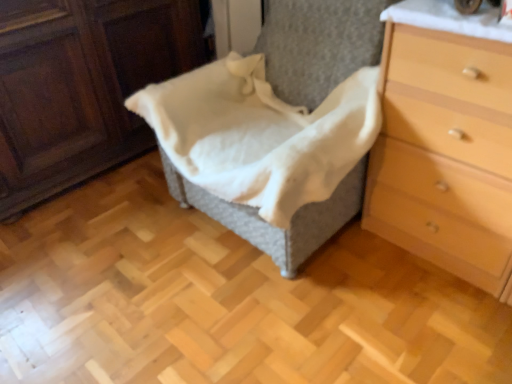
The image size is (512, 384). What are the coordinates of `light brown wood chest of drawers at right` in the screenshot? It's located at (445, 153).

Measure the distance between point (5, 214) and camera.

A distance of 6.17 feet exists between point (5, 214) and camera.

This screenshot has width=512, height=384. What are the coordinates of `white cotton blanket at center` in the screenshot? It's located at [260, 134].

Where is `light brown wood chest of drawers at right`? The image size is (512, 384). light brown wood chest of drawers at right is located at coordinates (445, 153).

From their relative heights in the image, would you say light brown wood chest of drawers at right is taller or shorter than woven fabric basket at center?

In the image, light brown wood chest of drawers at right appears to be shorter than woven fabric basket at center.

Is the surface of light brown wood chest of drawers at right in direct contact with woven fabric basket at center?

No, light brown wood chest of drawers at right is not in contact with woven fabric basket at center.

In the scene shown: Can you confirm if light brown wood chest of drawers at right is smaller than woven fabric basket at center?

Correct, light brown wood chest of drawers at right occupies less space than woven fabric basket at center.

Between light brown wood chest of drawers at right and woven fabric basket at center, which one has larger width?

woven fabric basket at center.

Which of these two, white cotton blanket at center or light brown wood chest of drawers at right, stands taller?

light brown wood chest of drawers at right.

Is white cotton blanket at center looking in the opposite direction of light brown wood chest of drawers at right?

That's not correct — white cotton blanket at center is not looking away from light brown wood chest of drawers at right.

Can you tell me how much white cotton blanket at center and light brown wood chest of drawers at right differ in facing direction?

0.538 degrees separate the facing orientations of white cotton blanket at center and light brown wood chest of drawers at right.

From the image's perspective, which is above, white cotton blanket at center or light brown wood chest of drawers at right?

white cotton blanket at center is shown above in the image.

Which is more to the left, white cotton blanket at center or woven fabric basket at center?

From the viewer's perspective, woven fabric basket at center appears more on the left side.

From a real-world perspective, which is physically above, white cotton blanket at center or woven fabric basket at center?

white cotton blanket at center is physically above.

Based on their sizes in the image, would you say white cotton blanket at center is bigger or smaller than woven fabric basket at center?

Clearly, white cotton blanket at center is smaller in size than woven fabric basket at center.

Who is shorter, light brown wood chest of drawers at right or white cotton blanket at center?

With less height is white cotton blanket at center.

From a real-world perspective, who is located lower, light brown wood chest of drawers at right or white cotton blanket at center?

From a 3D spatial view, light brown wood chest of drawers at right is below.

Which is more to the left, light brown wood chest of drawers at right or white cotton blanket at center?

white cotton blanket at center is more to the left.

Is light brown wood chest of drawers at right not inside white cotton blanket at center?

Indeed, light brown wood chest of drawers at right is completely outside white cotton blanket at center.

Is woven fabric basket at center positioned far away from light brown wood chest of drawers at right?

woven fabric basket at center is far away from light brown wood chest of drawers at right.

Does woven fabric basket at center turn towards light brown wood chest of drawers at right?

Yes, woven fabric basket at center is turned towards light brown wood chest of drawers at right.

The height and width of the screenshot is (384, 512). In order to click on furniture behind the light brown wood chest of drawers at right in this screenshot , I will do `click(81, 86)`.

Considering the relative sizes of woven fabric basket at center and white cotton blanket at center in the image provided, is woven fabric basket at center wider than white cotton blanket at center?

No, woven fabric basket at center is not wider than white cotton blanket at center.

From a real-world perspective, is woven fabric basket at center positioned above or below white cotton blanket at center?

From a real-world perspective, woven fabric basket at center is physically below white cotton blanket at center.

Would you say woven fabric basket at center contains white cotton blanket at center?

Actually, white cotton blanket at center is outside woven fabric basket at center.

Is point (7, 29) positioned before point (208, 120)?

Yes, it is.

Locate an element on the screen. The image size is (512, 384). chest of drawers in front of the woven fabric basket at center is located at coordinates (445, 153).

Image resolution: width=512 pixels, height=384 pixels. What are the coordinates of `the chest of drawers below the white cotton blanket at center (from a real-world perspective)` in the screenshot? It's located at (445, 153).

When comparing their distances from white cotton blanket at center, does woven fabric basket at center or light brown wood chest of drawers at right seem closer?

light brown wood chest of drawers at right lies closer to white cotton blanket at center than the other object.

Estimate the real-world distances between objects in this image. Which object is further from light brown wood chest of drawers at right, white cotton blanket at center or woven fabric basket at center?

Based on the image, woven fabric basket at center appears to be further to light brown wood chest of drawers at right.

Estimate the real-world distances between objects in this image. Which object is further from woven fabric basket at center, light brown wood chest of drawers at right or white cotton blanket at center?

light brown wood chest of drawers at right.

Looking at the image, which one is located further to light brown wood chest of drawers at right, woven fabric basket at center or white cotton blanket at center?

woven fabric basket at center.

When comparing their distances from woven fabric basket at center, does white cotton blanket at center or light brown wood chest of drawers at right seem further?

light brown wood chest of drawers at right is positioned further to the anchor woven fabric basket at center.

Estimate the real-world distances between objects in this image. Which object is further from white cotton blanket at center, light brown wood chest of drawers at right or woven fabric basket at center?

woven fabric basket at center lies further to white cotton blanket at center than the other object.

I want to click on blanket between woven fabric basket at center and light brown wood chest of drawers at right, so coord(260,134).